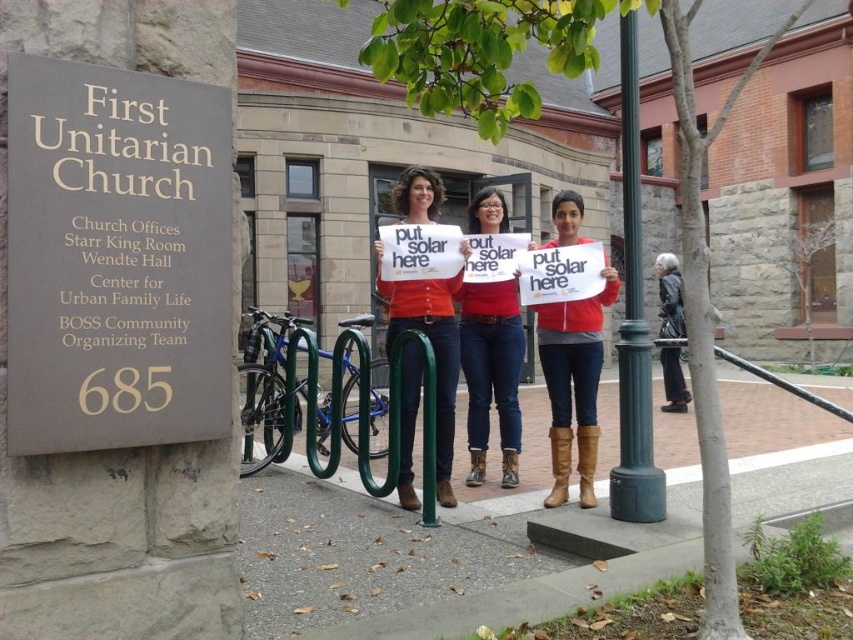
Question: Considering the relative positions of gold/golden stone sign at upper left and red zippered jacket at center in the image provided, where is gold/golden stone sign at upper left located with respect to red zippered jacket at center?

Choices:
 (A) left
 (B) right

Answer: (A)

Question: Which of the following is the farthest from the observer?

Choices:
 (A) green painted metal pole at right
 (B) red zippered jacket at center
 (C) leather jacket at center
 (D) matte red shirt at center

Answer: (C)

Question: Does red zippered jacket at center appear on the left side of matte red shirt at center?

Choices:
 (A) no
 (B) yes

Answer: (A)

Question: Is gold/golden stone sign at upper left further to camera compared to matte orange shirt at center?

Choices:
 (A) no
 (B) yes

Answer: (A)

Question: Among these points, which one is farthest from the camera?

Choices:
 (A) (672, 323)
 (B) (630, 80)
 (C) (469, 227)

Answer: (A)

Question: Based on their relative distances, which object is nearer to the matte red shirt at center?

Choices:
 (A) gold/golden stone sign at upper left
 (B) matte orange shirt at center
 (C) green painted metal pole at right

Answer: (B)